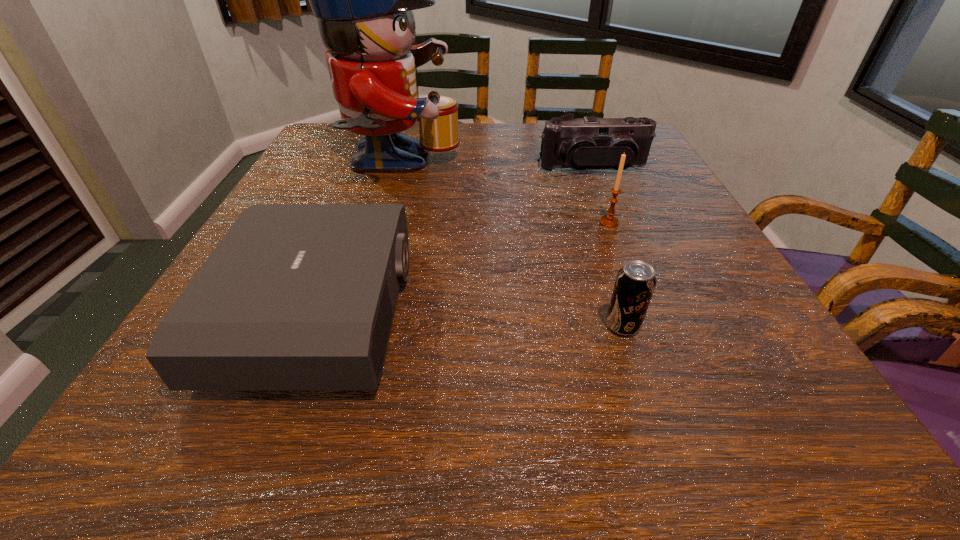
Locate an element on the screen. This screenshot has height=540, width=960. the tallest object is located at coordinates (363, 0).

You are a GUI agent. You are given a task and a screenshot of the screen. Output one action in this format:
    pyautogui.click(x=<x>, y=<y>)
    Task: Click on the fourth shortest object
    
    Given the screenshot: What is the action you would take?
    pyautogui.click(x=609, y=220)

Identify the location of the third nearest object. This screenshot has width=960, height=540. (609, 220).

In order to click on camcorder in this screenshot , I will do `click(584, 143)`.

What are the coordinates of `soda can` in the screenshot? It's located at (635, 282).

Locate an element on the screen. The width and height of the screenshot is (960, 540). projector is located at coordinates (295, 296).

Image resolution: width=960 pixels, height=540 pixels. Find the location of `vacant space located on the front-facing side of the nutcracker`. vacant space located on the front-facing side of the nutcracker is located at coordinates (535, 165).

You are a GUI agent. You are given a task and a screenshot of the screen. Output one action in this format:
    pyautogui.click(x=<x>, y=<y>)
    Task: Click on the vacant area situated 0.150m on the front of the fourth shortest object
    
    Given the screenshot: What is the action you would take?
    pyautogui.click(x=631, y=278)

The height and width of the screenshot is (540, 960). I want to click on vacant space located on the front-facing side of the camcorder, so click(x=616, y=227).

This screenshot has height=540, width=960. What are the coordinates of `vacant space located on the left of the soda can` in the screenshot? It's located at (355, 326).